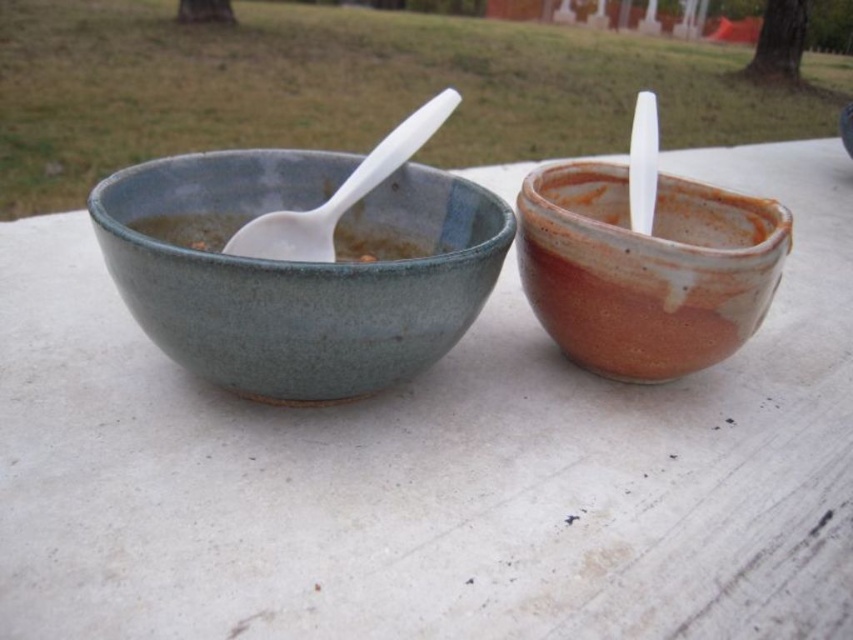
Question: Which is nearer to the matte clay bowl at right?

Choices:
 (A) matte ceramic bowl at left
 (B) matte ceramic soup at left
 (C) white plastic spoon at left

Answer: (A)

Question: Where is matte ceramic bowl at left located in relation to matte ceramic soup at left in the image?

Choices:
 (A) right
 (B) left

Answer: (A)

Question: Is white plastic spoon at left positioned before matte ceramic soup at left?

Choices:
 (A) yes
 (B) no

Answer: (A)

Question: Which of the following is the farthest from the observer?

Choices:
 (A) (282, 227)
 (B) (144, 292)

Answer: (A)

Question: Observing the image, what is the correct spatial positioning of matte ceramic bowl at left in reference to white plastic spoon at left?

Choices:
 (A) below
 (B) above

Answer: (A)

Question: Which point is farther to the camera?

Choices:
 (A) matte clay bowl at right
 (B) white plastic spoon at left
 (C) matte ceramic soup at left

Answer: (C)